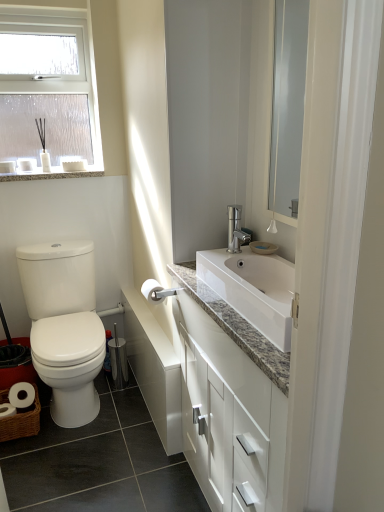
Question: Considering the positions of white glossy toilet at left and frosted glass window at upper left in the image, is white glossy toilet at left taller or shorter than frosted glass window at upper left?

Choices:
 (A) short
 (B) tall

Answer: (A)

Question: Visually, is white glossy toilet at left positioned to the left or to the right of frosted glass window at upper left?

Choices:
 (A) right
 (B) left

Answer: (A)

Question: Which object is positioned farthest from the white glossy cabinet at center?

Choices:
 (A) granite countertop at upper left
 (B) frosted glass window at upper left
 (C) white glossy toilet at left

Answer: (A)

Question: Estimate the real-world distances between objects in this image. Which object is closer to the frosted glass window at upper left?

Choices:
 (A) white glossy toilet at left
 (B) granite countertop at upper left
 (C) white glossy cabinet at center

Answer: (B)